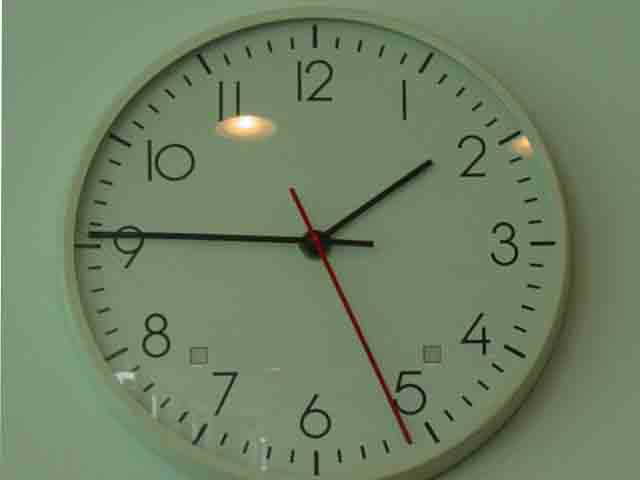
Identify the location of clock hour markers. The width and height of the screenshot is (640, 480). (198, 57), (209, 73), (124, 143), (83, 243), (314, 43), (315, 28).